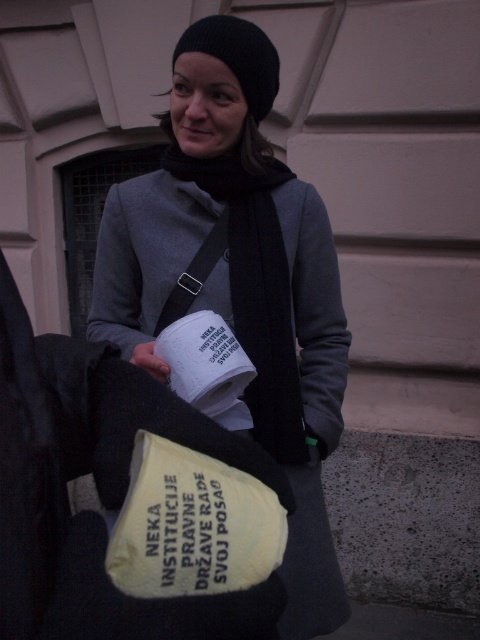
What are the coordinates of `white matte paper cup at center` in the screenshot? It's located at (207, 365).

Measure the distance between point [207,346] and camera.

Point [207,346] and camera are 3.79 feet apart from each other.

Identify the location of white matte paper cup at center. (207, 365).

I want to click on white matte paper cup at center, so click(207, 365).

Is matte gray sweater at center shorter than white matte paper cup at center?

In fact, matte gray sweater at center may be taller than white matte paper cup at center.

The height and width of the screenshot is (640, 480). What do you see at coordinates (240, 280) in the screenshot?
I see `matte gray sweater at center` at bounding box center [240, 280].

This screenshot has height=640, width=480. In order to click on matte gray sweater at center in this screenshot , I will do `click(240, 280)`.

Is point (294, 205) less distant than point (240, 45)?

No, (294, 205) is further to viewer.

Which is more to the left, matte gray sweater at center or black knit hat at upper center?

From the viewer's perspective, matte gray sweater at center appears more on the left side.

Between point (300, 307) and point (200, 20), which one is positioned behind?

Point (300, 307)

Where is `matte gray sweater at center`? This screenshot has width=480, height=640. matte gray sweater at center is located at coordinates (240, 280).